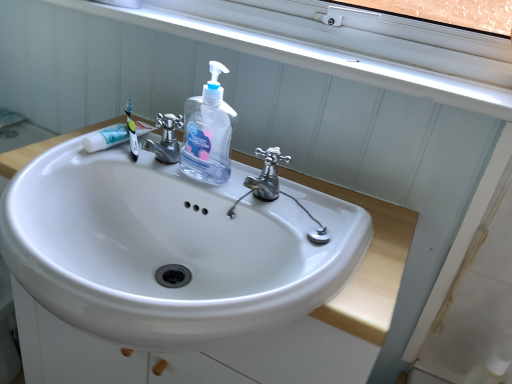
The height and width of the screenshot is (384, 512). What are the coordinates of `vacant area that lies in front of white glossy tube at upper left` in the screenshot? It's located at [81, 164].